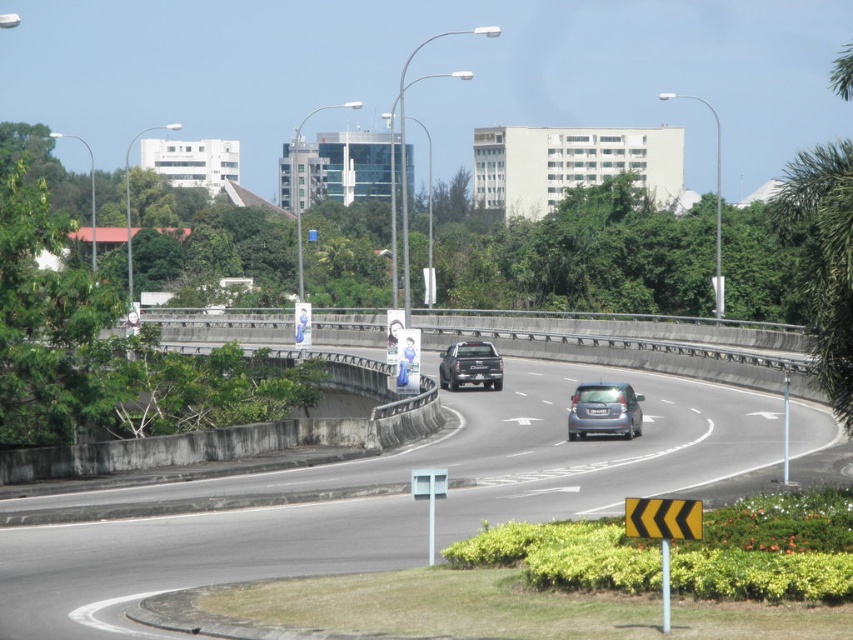
Consider the image. You are standing at the point marked by coordinates point [383,499]. What is the surface material under your feet?

The surface material at point [383,499] is smooth asphalt road at center.

You are a pedestrian standing at the edge of the road. You see a satin silver hatchback at center and a matte black truck at center. Which vehicle is closer to the road surface?

A: The satin silver hatchback at center is positioned under the matte black truck at center, so the satin silver hatchback at center is closer to the road surface.